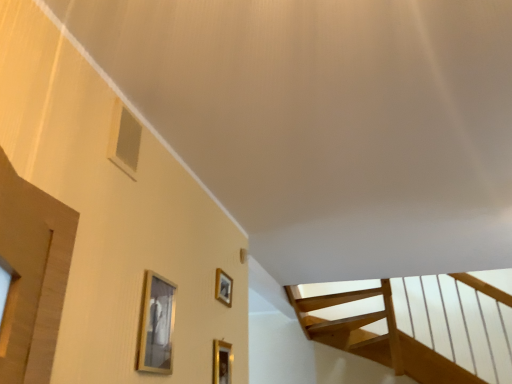
Question: Which direction should I rotate to look at gold metallic picture frame at lower center, the 1th picture frame positioned from the front?

Choices:
 (A) right
 (B) left

Answer: (B)

Question: From a real-world perspective, does gold metallic picture frame at lower center, positioned as the second picture frame in front-to-back order, stand above matte silver picture frame at center, placed as the 2th picture frame when sorted from left to right?

Choices:
 (A) yes
 (B) no

Answer: (B)

Question: From the image's perspective, is gold metallic picture frame at lower center, positioned as the second picture frame in front-to-back order, beneath matte silver picture frame at center, positioned as the first picture frame in back-to-front order?

Choices:
 (A) yes
 (B) no

Answer: (A)

Question: Does gold metallic picture frame at lower center, the 3th picture frame viewed from the left, turn towards matte silver picture frame at center, the second picture frame positioned from the right?

Choices:
 (A) yes
 (B) no

Answer: (B)

Question: Is the position of gold metallic picture frame at lower center, positioned as the second picture frame in front-to-back order, more distant than that of matte silver picture frame at center, positioned as the first picture frame in back-to-front order?

Choices:
 (A) yes
 (B) no

Answer: (B)

Question: Is gold metallic picture frame at lower center, positioned as the second picture frame in front-to-back order, at the right side of matte silver picture frame at center, acting as the third picture frame starting from the front?

Choices:
 (A) no
 (B) yes

Answer: (B)

Question: Is gold metallic picture frame at lower center, positioned as the second picture frame in back-to-front order, positioned before matte silver picture frame at center, placed as the 2th picture frame when sorted from left to right?

Choices:
 (A) no
 (B) yes

Answer: (B)

Question: Does gold metallic picture frame at lower center, which appears as the 1th picture frame when viewed from the left, appear on the left side of matte silver picture frame at center, placed as the 2th picture frame when sorted from left to right?

Choices:
 (A) yes
 (B) no

Answer: (A)

Question: From the image's perspective, is gold metallic picture frame at lower center, the 1th picture frame positioned from the front, under matte silver picture frame at center, positioned as the first picture frame in back-to-front order?

Choices:
 (A) yes
 (B) no

Answer: (B)

Question: Is gold metallic picture frame at lower center, which appears as the 1th picture frame when viewed from the left, bigger than matte silver picture frame at center, positioned as the first picture frame in back-to-front order?

Choices:
 (A) yes
 (B) no

Answer: (A)

Question: Does gold metallic picture frame at lower center, which is counted as the third picture frame, starting from the back, have a greater height compared to matte silver picture frame at center, positioned as the first picture frame in back-to-front order?

Choices:
 (A) no
 (B) yes

Answer: (B)

Question: Does gold metallic picture frame at lower center, which appears as the 1th picture frame when viewed from the left, touch matte silver picture frame at center, the second picture frame positioned from the right?

Choices:
 (A) yes
 (B) no

Answer: (B)

Question: Does gold metallic picture frame at lower center, which appears as the 1th picture frame when viewed from the left, have a lesser width compared to matte silver picture frame at center, the second picture frame positioned from the right?

Choices:
 (A) no
 (B) yes

Answer: (A)

Question: Is matte silver picture frame at center, the second picture frame positioned from the right, not within gold metallic picture frame at lower center, the 1th picture frame from the right?

Choices:
 (A) no
 (B) yes

Answer: (B)